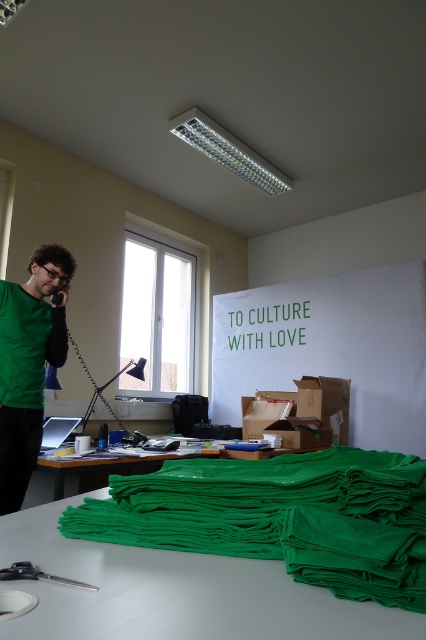
Between green fabric at lower center and green matte shirt at left, which one appears on the right side from the viewer's perspective?

green fabric at lower center

Which is in front, point (331, 545) or point (19, 317)?

Point (331, 545) is in front.

Is point (345, 486) closer to viewer compared to point (2, 296)?

Yes, it is in front of point (2, 296).

You are a GUI agent. You are given a task and a screenshot of the screen. Output one action in this format:
    pyautogui.click(x=<x>, y=<y>)
    Task: Click on the green fabric at lower center
    
    Given the screenshot: What is the action you would take?
    pyautogui.click(x=281, y=516)

Between green fabric at lower center and green fabric at center, which one has more height?

With more height is green fabric at center.

The height and width of the screenshot is (640, 426). What do you see at coordinates (281, 516) in the screenshot?
I see `green fabric at lower center` at bounding box center [281, 516].

This screenshot has width=426, height=640. Identify the location of green fabric at lower center. [x=281, y=516].

Who is more distant from viewer, [40,396] or [40,465]?

Positioned behind is point [40,396].

Which is more to the left, green matte shirt at left or green fabric at center?

green matte shirt at left

Where is `green matte shirt at left`? The image size is (426, 640). green matte shirt at left is located at coordinates (28, 364).

In order to click on green matte shirt at left in this screenshot , I will do [28, 364].